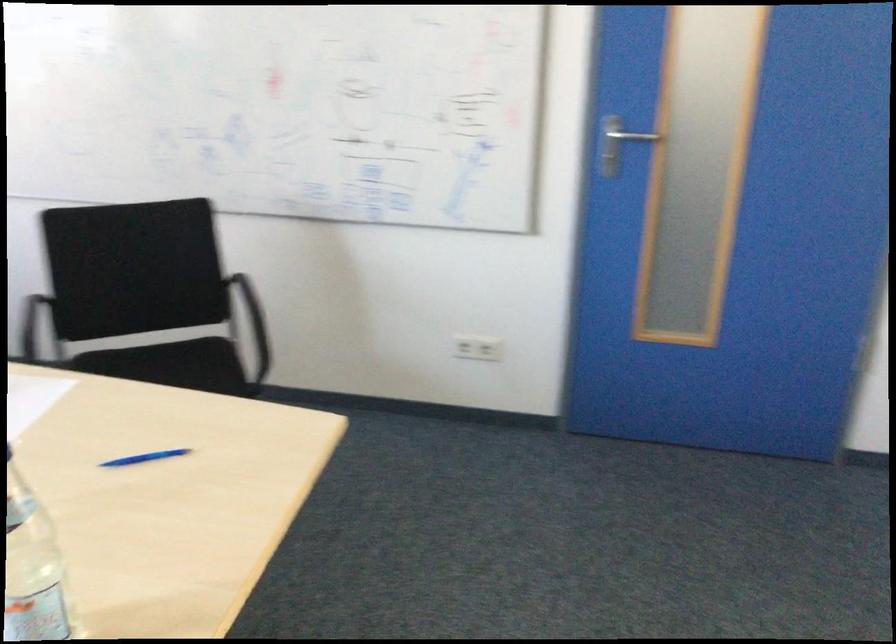
Locate an element on the screen. The width and height of the screenshot is (896, 644). black chair armrest is located at coordinates (243, 290).